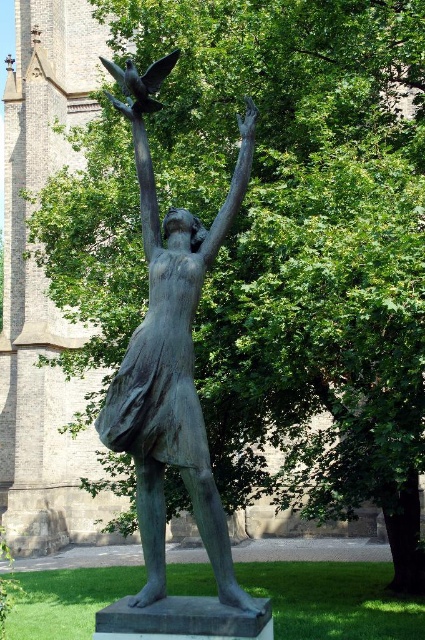
Does bronze statue at center appear on the right side of shiny black bird at upper center?

Yes, bronze statue at center is to the right of shiny black bird at upper center.

Does bronze statue at center have a lesser width compared to shiny black bird at upper center?

Incorrect, bronze statue at center's width is not less than shiny black bird at upper center's.

Where is `bronze statue at center`? The image size is (425, 640). bronze statue at center is located at coordinates (172, 372).

You are a GUI agent. You are given a task and a screenshot of the screen. Output one action in this format:
    pyautogui.click(x=<x>, y=<y>)
    Task: Click on the bronze statue at center
    The height and width of the screenshot is (640, 425).
    Given the screenshot: What is the action you would take?
    pyautogui.click(x=172, y=372)